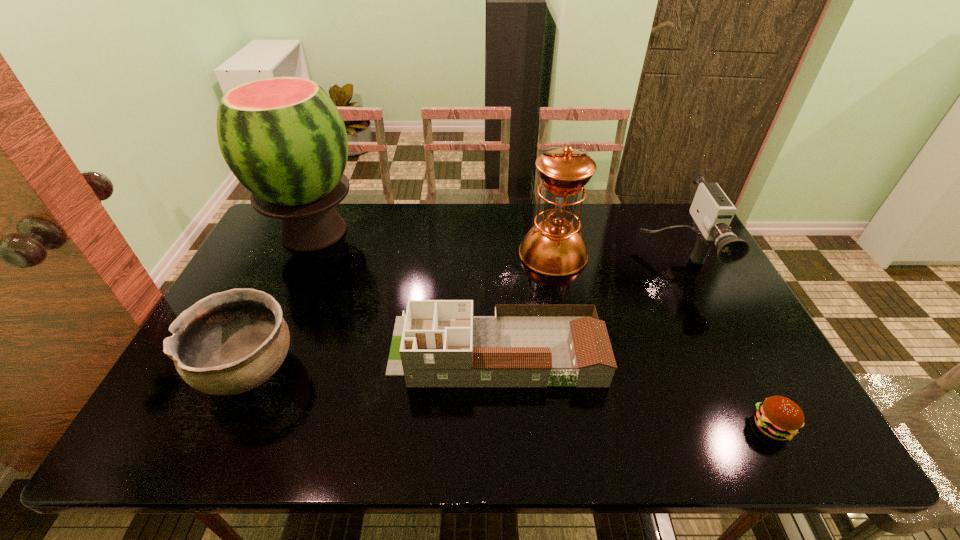
Find the location of a particular element. The height and width of the screenshot is (540, 960). vacant point located at the main entrance of the dollhouse is located at coordinates (293, 350).

The image size is (960, 540). What are the coordinates of `vacant space located at the main entrance of the dollhouse` in the screenshot? It's located at (363, 350).

Where is `free spot located 0.150m on the back of the pottery`? This screenshot has height=540, width=960. free spot located 0.150m on the back of the pottery is located at coordinates (285, 291).

At what (x,y) coordinates should I click in order to perform the action: click on vacant region located 0.060m on the back of the hamburger. Please return your answer as a coordinate pair (x, y). Looking at the image, I should click on (751, 385).

Identify the location of watermelon present at the far edge. This screenshot has width=960, height=540. (283, 138).

Identify the location of oil lamp that is at the far edge. The image size is (960, 540). (554, 247).

Locate an element on the screen. The height and width of the screenshot is (540, 960). camcorder at the far edge is located at coordinates (712, 211).

Locate an element on the screen. object that is at the near edge is located at coordinates (778, 417).

At what (x,y) coordinates should I click in order to perform the action: click on watermelon located at the left edge. Please return your answer as a coordinate pair (x, y). The height and width of the screenshot is (540, 960). Looking at the image, I should click on 283,138.

Where is `pottery that is positioned at the left edge`? pottery that is positioned at the left edge is located at coordinates (231, 342).